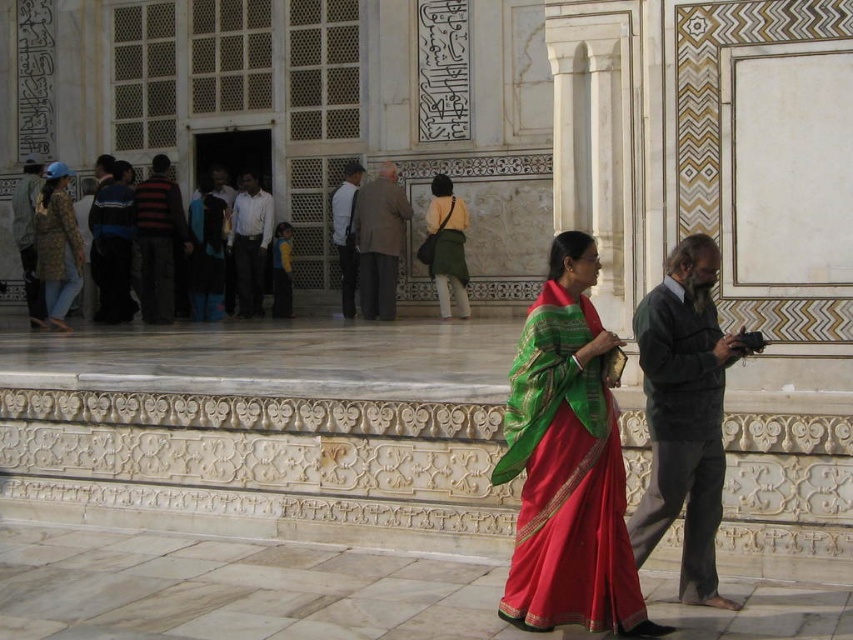
Question: In this image, where is white cotton shirt at center located relative to matte black shirt at left?

Choices:
 (A) right
 (B) left

Answer: (A)

Question: Which of the following is the farthest from the observer?

Choices:
 (A) (349, 195)
 (B) (387, 168)
 (C) (25, 252)
 (D) (107, 253)

Answer: (C)

Question: Is light brown fabric coat at center below light brown leather jacket at center?

Choices:
 (A) yes
 (B) no

Answer: (A)

Question: Among these objects, which one is farthest from the camera?

Choices:
 (A) patterned fabric jacket at left
 (B) white cotton shirt at center
 (C) striped sweater at center

Answer: (B)

Question: Can you confirm if white cotton shirt at center is positioned below matte black shirt at left?

Choices:
 (A) no
 (B) yes

Answer: (A)

Question: Which point is farther to the camera?

Choices:
 (A) white cotton shirt at center
 (B) silky red sari at center
 (C) patterned fabric jacket at left
 (D) light brown fabric coat at center

Answer: (A)